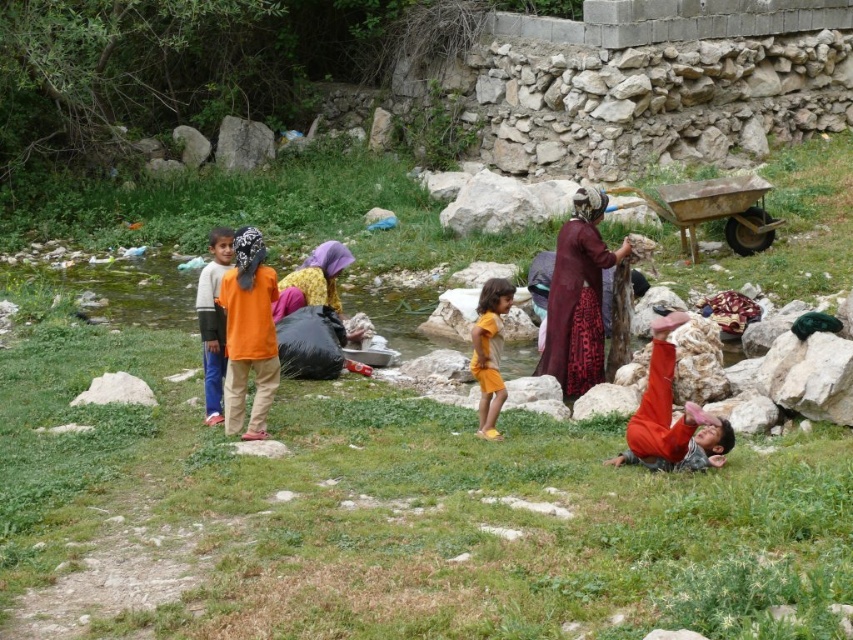
Question: Among these objects, which one is nearest to the camera?

Choices:
 (A) orange cotton shirt at left
 (B) orange fabric headscarf at center
 (C) orange cotton shirt at lower right

Answer: (C)

Question: Which is farther from the orange cotton shirt at lower right?

Choices:
 (A) yellow matte shorts at center
 (B) orange cotton shirt at left

Answer: (B)

Question: Is maroon fabric dress at center wider than orange cotton shirt at center?

Choices:
 (A) no
 (B) yes

Answer: (B)

Question: Can you confirm if maroon fabric dress at center is positioned below orange fabric headscarf at center?

Choices:
 (A) no
 (B) yes

Answer: (B)

Question: Which is nearer to the orange cotton shirt at lower right?

Choices:
 (A) yellow matte shorts at center
 (B) maroon fabric dress at center
 (C) orange cotton shirt at left

Answer: (A)

Question: Can you confirm if maroon fabric dress at center is bigger than orange cotton shirt at lower right?

Choices:
 (A) yes
 (B) no

Answer: (A)